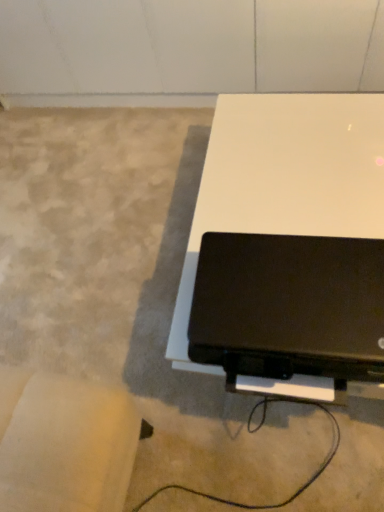
Image resolution: width=384 pixels, height=512 pixels. In order to click on free space behind black matte laptop at lower right in this screenshot , I will do `click(276, 197)`.